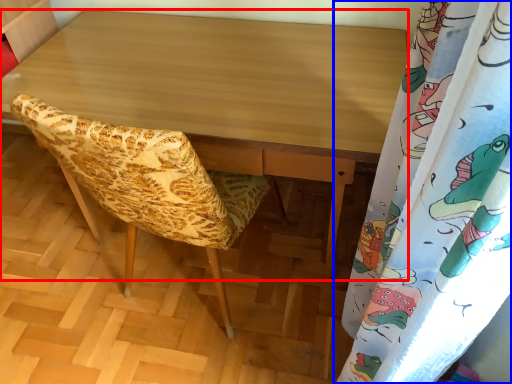
Question: Which point is further to the camera, desk (highlighted by a red box) or curtain (highlighted by a blue box)?

Choices:
 (A) desk
 (B) curtain

Answer: (A)